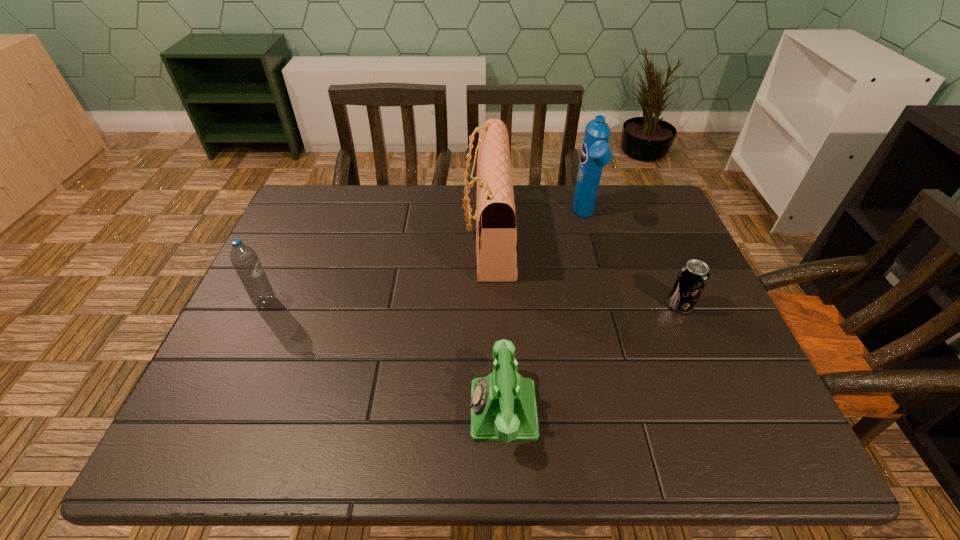
At what (x,y) coordinates should I click in order to perform the action: click on vacant area in the image that satisfies the following two spatial constraints: 1. on the front side of the soda can; 2. on the right side of the second object from right to left. Please return your answer as a coordinate pair (x, y). Looking at the image, I should click on (609, 305).

Find the location of a particular element. This screenshot has height=540, width=960. free region that satisfies the following two spatial constraints: 1. on the back side of the water bottle; 2. on the right side of the fourth object from left to right is located at coordinates (305, 217).